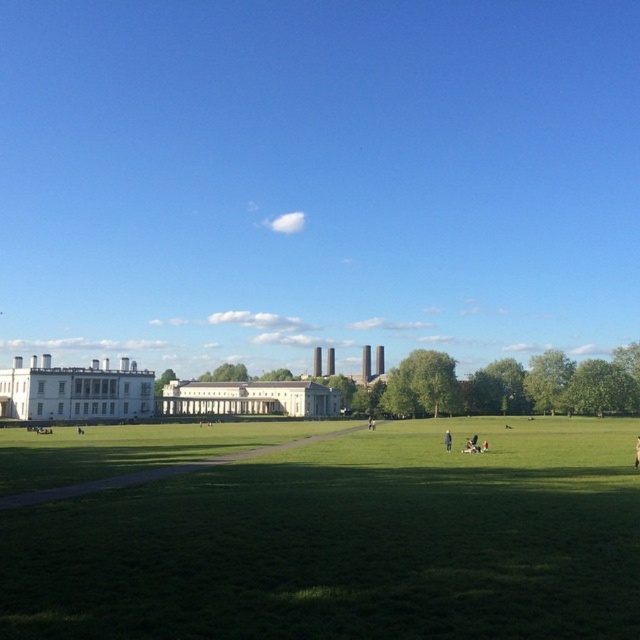
Does green grass at center appear on the left side of brown leather jacket at center?

Yes, green grass at center is to the left of brown leather jacket at center.

Does point (177, 576) come in front of point (636, 467)?

Yes, it is.

Measure the distance between point [200,572] and camera.

Point [200,572] is 16.53 meters away from camera.

Find the location of a particular element. The height and width of the screenshot is (640, 640). green grass at center is located at coordinates (324, 532).

Between point (212, 561) and point (445, 435), which one is positioned behind?

Positioned behind is point (445, 435).

Does green grass at center lie behind dark blue fabric at center?

No, green grass at center is in front of dark blue fabric at center.

I want to click on green grass at center, so click(x=324, y=532).

Where is `green grass at center`? The width and height of the screenshot is (640, 640). green grass at center is located at coordinates (324, 532).

Is blue sky at upper center taller than dark blue fabric at center?

Indeed, blue sky at upper center has a greater height compared to dark blue fabric at center.

Which is behind, point (419, 28) or point (451, 445)?

The point (419, 28) is more distant.

You are a GUI agent. You are given a task and a screenshot of the screen. Output one action in this format:
    pyautogui.click(x=<x>, y=<y>)
    Task: Click on the blue sky at upper center
    
    Given the screenshot: What is the action you would take?
    pyautogui.click(x=317, y=179)